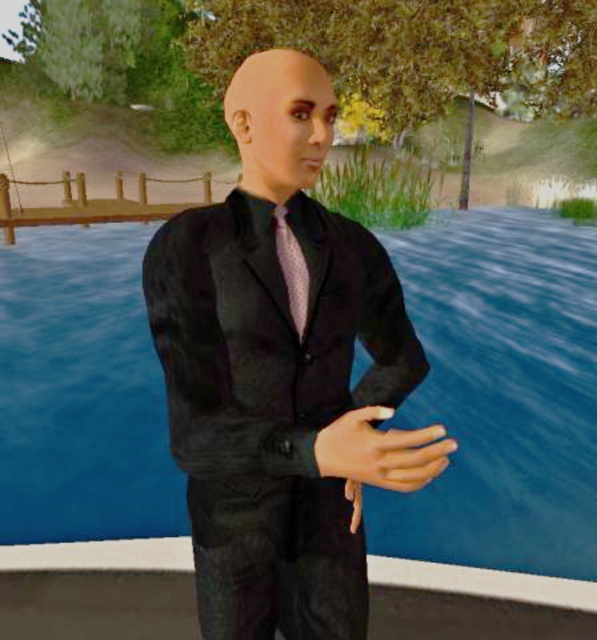
Question: Is black satin suit at center closer to camera compared to pink dotted fabric tie at center?

Choices:
 (A) yes
 (B) no

Answer: (A)

Question: Among these points, which one is farthest from the camera?

Choices:
 (A) (293, 269)
 (B) (279, 349)

Answer: (A)

Question: Does black satin suit at center appear under pink dotted fabric tie at center?

Choices:
 (A) yes
 (B) no

Answer: (A)

Question: Does black satin suit at center have a lesser width compared to pink dotted fabric tie at center?

Choices:
 (A) no
 (B) yes

Answer: (A)